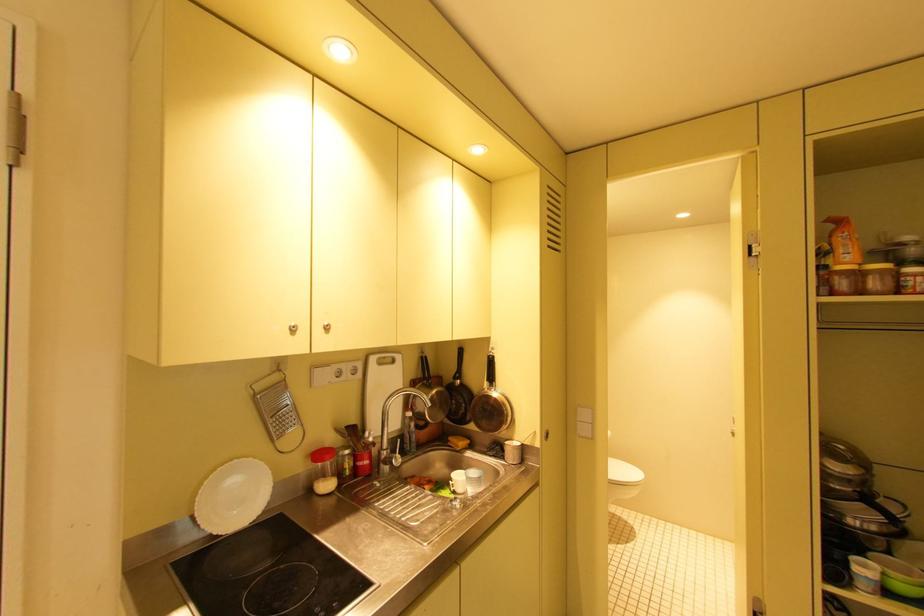
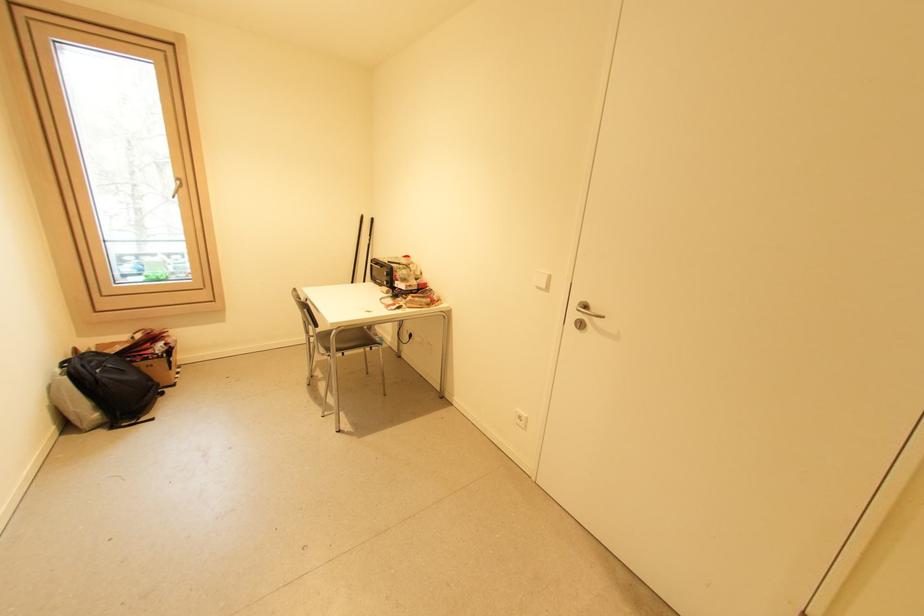
How did the camera likely rotate?

The rotation direction of the camera is left-down.